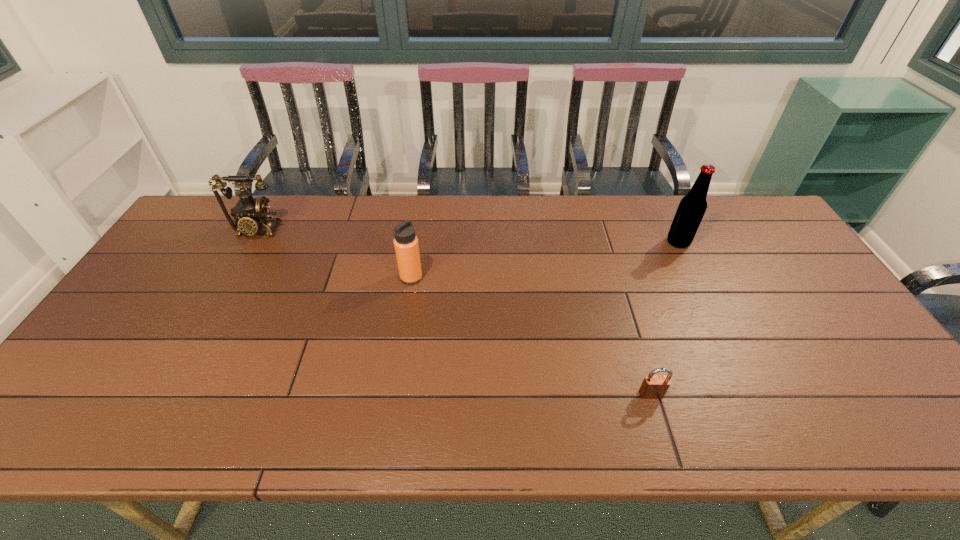
You are a GUI agent. You are given a task and a screenshot of the screen. Output one action in this format:
    pyautogui.click(x=<x>, y=<y>)
    Task: Click on the free space at the near right corner of the desktop
    The image size is (960, 540).
    Given the screenshot: What is the action you would take?
    pyautogui.click(x=879, y=423)

Image resolution: width=960 pixels, height=540 pixels. Identify the location of vacant space that's between the rightmost object and the telephone. (468, 237).

Image resolution: width=960 pixels, height=540 pixels. I want to click on vacant area that lies between the nearest object and the second nearest object, so click(x=531, y=336).

Locate an element on the screen. This screenshot has height=540, width=960. free space between the third object from right to left and the telephone is located at coordinates (334, 254).

Locate an element on the screen. The image size is (960, 540). vacant area that lies between the leftmost object and the beer bottle is located at coordinates (468, 237).

Image resolution: width=960 pixels, height=540 pixels. What are the coordinates of `free spot between the rightmost object and the shortest object` in the screenshot? It's located at (664, 319).

Find the location of `vacant point located between the rightmost object and the leftmost object`. vacant point located between the rightmost object and the leftmost object is located at coordinates (468, 237).

This screenshot has width=960, height=540. What are the coordinates of `blank region between the second nearest object and the rightmost object` in the screenshot? It's located at [544, 260].

This screenshot has width=960, height=540. I want to click on free space between the beer bottle and the second object from right to left, so click(664, 319).

Where is `empty location between the second nearest object and the telephone`? The image size is (960, 540). empty location between the second nearest object and the telephone is located at coordinates (334, 254).